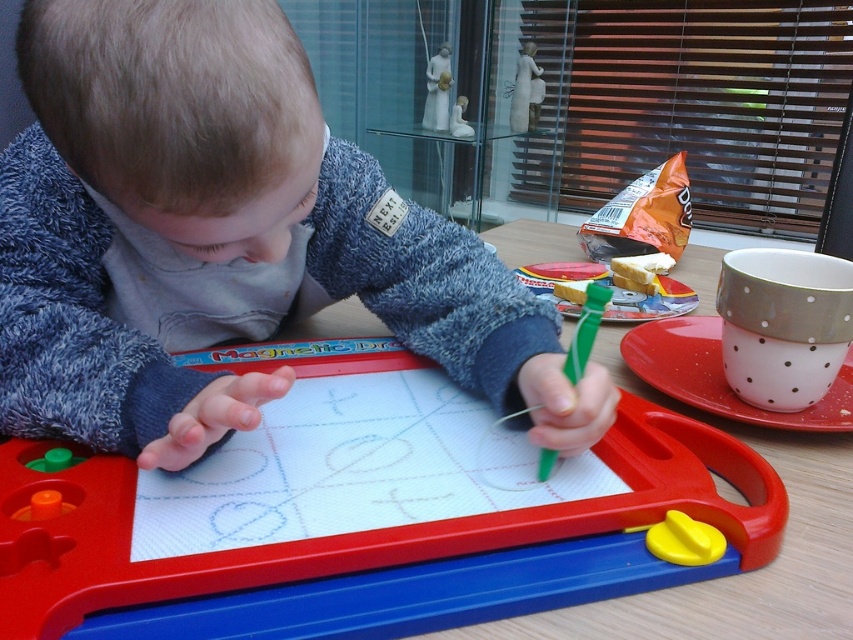
Question: Which point is farther from the camera taking this photo?

Choices:
 (A) (107, 448)
 (B) (572, 364)

Answer: (A)

Question: Does wooden table at center have a smaller size compared to green plastic crayon at center?

Choices:
 (A) no
 (B) yes

Answer: (A)

Question: Is wooden table at center to the left of green plastic crayon at center from the viewer's perspective?

Choices:
 (A) no
 (B) yes

Answer: (A)

Question: Which of the following is the closest to the observer?

Choices:
 (A) (552, 467)
 (B) (660, 616)
 (C) (558, 401)

Answer: (B)

Question: Which is farther from the soft blue sweater at center?

Choices:
 (A) wooden table at center
 (B) green plastic crayon at center

Answer: (B)

Question: Does soft blue sweater at center have a larger size compared to green plastic crayon at center?

Choices:
 (A) yes
 (B) no

Answer: (A)